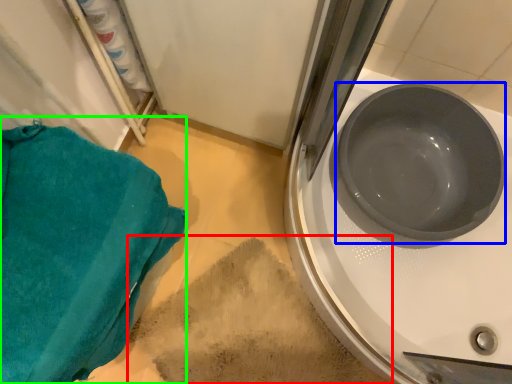
Question: Based on their relative distances, which object is farther from dirt (highlighted by a red box)? Choose from basin (highlighted by a blue box) and towel/napkin (highlighted by a green box).

Choices:
 (A) basin
 (B) towel/napkin

Answer: (A)